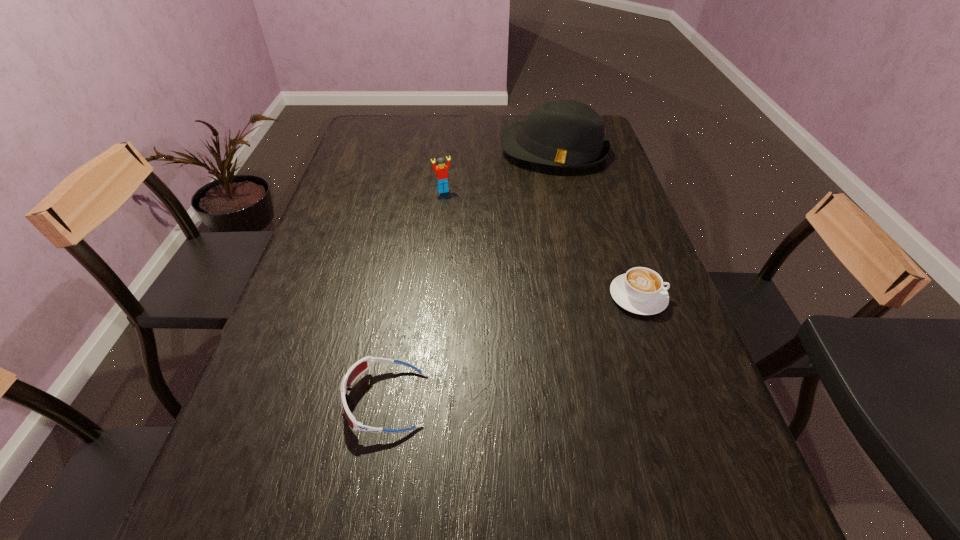
This screenshot has width=960, height=540. I want to click on free space located on the face of the third nearest object, so click(x=469, y=239).

Where is `vacant space situated 0.310m on the front-facing side of the tallest object`? This screenshot has width=960, height=540. vacant space situated 0.310m on the front-facing side of the tallest object is located at coordinates (538, 234).

The width and height of the screenshot is (960, 540). Identify the location of vacant space located 0.290m on the front-facing side of the tallest object. (538, 230).

Image resolution: width=960 pixels, height=540 pixels. In order to click on vacant area located 0.190m on the front-facing side of the tallest object in this screenshot , I will do `click(541, 209)`.

Identify the location of object positioned at the far edge. (569, 134).

The width and height of the screenshot is (960, 540). I want to click on cappuccino present at the right edge, so click(x=640, y=291).

Identify the location of fedora positioned at the right edge. (569, 134).

Image resolution: width=960 pixels, height=540 pixels. Find the location of `object situated at the far right corner`. object situated at the far right corner is located at coordinates (569, 134).

Where is `free space at the far edge`? Image resolution: width=960 pixels, height=540 pixels. free space at the far edge is located at coordinates (409, 123).

In the image, there is a desktop. Find the location of `vacant space at the near edge`. vacant space at the near edge is located at coordinates (549, 449).